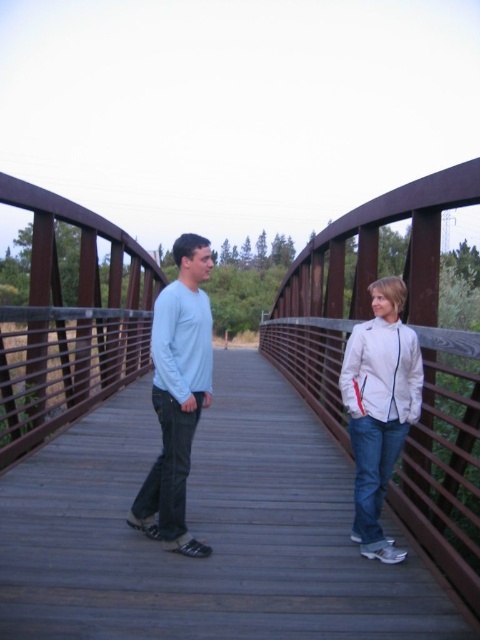
Question: Can you confirm if matte light blue long-sleeve shirt at center is bigger than white matte jacket at center?

Choices:
 (A) no
 (B) yes

Answer: (A)

Question: Can you confirm if matte light blue long-sleeve shirt at center is positioned below white matte jacket at center?

Choices:
 (A) no
 (B) yes

Answer: (A)

Question: Can you confirm if matte light blue long-sleeve shirt at center is wider than white matte jacket at center?

Choices:
 (A) no
 (B) yes

Answer: (A)

Question: Which object appears closest to the camera in this image?

Choices:
 (A) matte light blue long-sleeve shirt at center
 (B) white matte jacket at center

Answer: (A)

Question: Which point is closer to the camera taking this photo?

Choices:
 (A) (393, 342)
 (B) (144, 529)

Answer: (A)